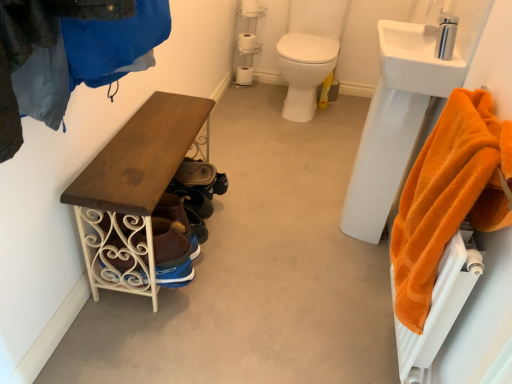
I want to click on leather shoe at center, so click(195, 173).

The image size is (512, 384). Describe the element at coordinates (195, 173) in the screenshot. I see `leather shoe at center` at that location.

Looking at this image, in order to face orange plush towel at right, should I rotate leftwards or rightwards?

To align with it, rotate right about 23.649°.

Image resolution: width=512 pixels, height=384 pixels. What do you see at coordinates (446, 36) in the screenshot?
I see `silver metallic faucet at upper right` at bounding box center [446, 36].

This screenshot has width=512, height=384. Find the location of `wooden bench at left`. wooden bench at left is located at coordinates (133, 191).

Find the location of a particular element. The height and width of the screenshot is (384, 512). white glossy toilet at center is located at coordinates (304, 71).

Find the location of a particular element. leather shoe at center is located at coordinates (195, 173).

Is wooden bench at left positioned before wooden bench at left?

No, wooden bench at left is behind wooden bench at left.

Does point (120, 276) come closer to viewer compared to point (231, 193)?

Yes, it is in front of point (231, 193).

Does wooden bench at left have a lesser width compared to wooden bench at left?

Yes, wooden bench at left is thinner than wooden bench at left.

Identify the location of concrete below the wooden bench at left (from a real-world perspective). (257, 270).

Is wooden bench at left far away from white matte toilet paper at upper center, positioned as the second toilet paper in top-to-bottom order?

wooden bench at left is far away from white matte toilet paper at upper center, positioned as the second toilet paper in top-to-bottom order.

Considering the sizes of objects wooden bench at left and white matte toilet paper at upper center, placed as the 2th toilet paper when sorted from bottom to top, in the image provided, who is bigger, wooden bench at left or white matte toilet paper at upper center, placed as the 2th toilet paper when sorted from bottom to top,?

Bigger between the two is wooden bench at left.

Is wooden bench at left further to camera compared to white matte toilet paper at upper center, placed as the 2th toilet paper when sorted from bottom to top?

No, it is not.

Is point (190, 368) in front of point (248, 36)?

Yes, it is.

From the image's perspective, relative to white matte toilet paper at upper center, which is the 1th toilet paper in front-to-back order, is silver metallic faucet at upper right above or below?

Clearly, from the image's perspective, silver metallic faucet at upper right is below white matte toilet paper at upper center, which is the 1th toilet paper in front-to-back order.

Is silver metallic faucet at upper right inside the boundaries of white matte toilet paper at upper center, the first toilet paper in the top-to-bottom sequence, or outside?

silver metallic faucet at upper right exists outside the volume of white matte toilet paper at upper center, the first toilet paper in the top-to-bottom sequence.

Considering the relative sizes of silver metallic faucet at upper right and white matte toilet paper at upper center, which is the third toilet paper in back-to-front order, in the image provided, is silver metallic faucet at upper right shorter than white matte toilet paper at upper center, which is the third toilet paper in back-to-front order,?

Indeed, silver metallic faucet at upper right has a lesser height compared to white matte toilet paper at upper center, which is the third toilet paper in back-to-front order.

Between point (443, 14) and point (244, 2), which one is positioned behind?

The point (244, 2) is behind.

Considering the sizes of objects orange plush towel at right and white matte toilet paper at center, which appears as the 3th toilet paper when viewed from the front, in the image provided, who is taller, orange plush towel at right or white matte toilet paper at center, which appears as the 3th toilet paper when viewed from the front,?

orange plush towel at right.

From the image's perspective, would you say orange plush towel at right is shown under white matte toilet paper at center, marked as the first toilet paper in a bottom-to-top arrangement?

Yes, from the image's perspective, orange plush towel at right is below white matte toilet paper at center, marked as the first toilet paper in a bottom-to-top arrangement.

From a real-world perspective, is orange plush towel at right over white matte toilet paper at center, the 3th toilet paper viewed from the top?

Yes, from a real-world perspective, orange plush towel at right is above white matte toilet paper at center, the 3th toilet paper viewed from the top.

Is orange plush towel at right facing towards white matte toilet paper at center, the 3th toilet paper viewed from the top?

No.

Considering the positions of objects white glossy toilet at center and wooden bench at left in the image provided, who is more to the left, white glossy toilet at center or wooden bench at left?

wooden bench at left.

Is white glossy toilet at center in contact with wooden bench at left?

white glossy toilet at center and wooden bench at left are not in contact.

The width and height of the screenshot is (512, 384). Identify the location of toilet behind the wooden bench at left. (304, 71).

Is point (292, 56) behind point (315, 261)?

Yes, point (292, 56) is behind point (315, 261).

Considering the relative sizes of white glossy toilet at center and white plastic shelf at center in the image provided, is white glossy toilet at center taller than white plastic shelf at center?

Correct, white glossy toilet at center is much taller as white plastic shelf at center.

How many degrees apart are the facing directions of white glossy toilet at center and white plastic shelf at center?

The angle between the facing direction of white glossy toilet at center and the facing direction of white plastic shelf at center is 0.202 degrees.

Consider the image. Is white glossy toilet at center oriented away from white plastic shelf at center?

That's not correct — white glossy toilet at center is not looking away from white plastic shelf at center.

Is white glossy toilet at center not near white plastic shelf at center?

white glossy toilet at center is actually quite close to white plastic shelf at center.

Who is bigger, silver metallic faucet at upper right or white glossy toilet at center?

white glossy toilet at center.

Which is in front, silver metallic faucet at upper right or white glossy toilet at center?

silver metallic faucet at upper right is more forward.

Is point (455, 34) positioned in front of point (296, 105)?

Yes, it is.

Is white glossy toilet at center surrounded by silver metallic faucet at upper right?

No, silver metallic faucet at upper right does not contain white glossy toilet at center.

Locate an element on the screen. The width and height of the screenshot is (512, 384). furniture that is on the left side of wooden bench at left is located at coordinates (133, 191).

Locate an element on the screen. the 2nd toilet paper directly above the wooden bench at left (from a real-world perspective) is located at coordinates (247, 42).

Considering their positions, is orange plush towel at right positioned closer to white ceramic sink at upper right than white plastic shelf at center?

Based on the image, orange plush towel at right appears to be nearer to white ceramic sink at upper right.

Considering their positions, is silver metallic faucet at upper right positioned closer to white matte toilet paper at upper center, which is the 1th toilet paper in front-to-back order, than leather shoe at center?

leather shoe at center is closer to white matte toilet paper at upper center, which is the 1th toilet paper in front-to-back order.

Looking at the image, which one is located further to white matte toilet paper at center, which appears as the 3th toilet paper when viewed from the front, wooden bench at left or wooden bench at left?

Based on the image, wooden bench at left appears to be further to white matte toilet paper at center, which appears as the 3th toilet paper when viewed from the front.

Which object lies further to the anchor point white ceramic sink at upper right, white glossy toilet at center or white plastic shelf at center?

white plastic shelf at center.

Looking at the image, which one is located closer to orange plush towel at right, white plastic shelf at center or white glossy toilet at center?

white glossy toilet at center lies closer to orange plush towel at right than the other object.

Looking at the image, which one is located further to white glossy toilet at center, orange plush towel at right or white matte toilet paper at center, marked as the first toilet paper in a bottom-to-top arrangement?

The object further to white glossy toilet at center is orange plush towel at right.

Estimate the real-world distances between objects in this image. Which object is further from leather shoe at center, white matte toilet paper at upper center, the first toilet paper in the top-to-bottom sequence, or wooden bench at left?

Based on the image, white matte toilet paper at upper center, the first toilet paper in the top-to-bottom sequence, appears to be further to leather shoe at center.

Looking at the image, which one is located further to leather shoe at center, white matte toilet paper at upper center, placed as the 2th toilet paper when sorted from front to back, or white matte toilet paper at upper center, the first toilet paper in the top-to-bottom sequence?

Based on the image, white matte toilet paper at upper center, the first toilet paper in the top-to-bottom sequence, appears to be further to leather shoe at center.

The width and height of the screenshot is (512, 384). Identify the location of shelf between leather shoe at center and white matte toilet paper at upper center, placed as the 2th toilet paper when sorted from bottom to top, from front to back. (246, 40).

At what (x,y) coordinates should I click in order to perform the action: click on toilet between white ceramic sink at upper right and white plastic shelf at center from front to back. Please return your answer as a coordinate pair (x, y). This screenshot has width=512, height=384. Looking at the image, I should click on (304, 71).

I want to click on concrete positioned between orange plush towel at right and white plastic shelf at center from near to far, so click(257, 270).

Where is `shoe between white ceramic sink at upper right and white matte toilet paper at upper center, positioned as the second toilet paper in top-to-bottom order, along the z-axis`? This screenshot has width=512, height=384. shoe between white ceramic sink at upper right and white matte toilet paper at upper center, positioned as the second toilet paper in top-to-bottom order, along the z-axis is located at coordinates (x=195, y=173).